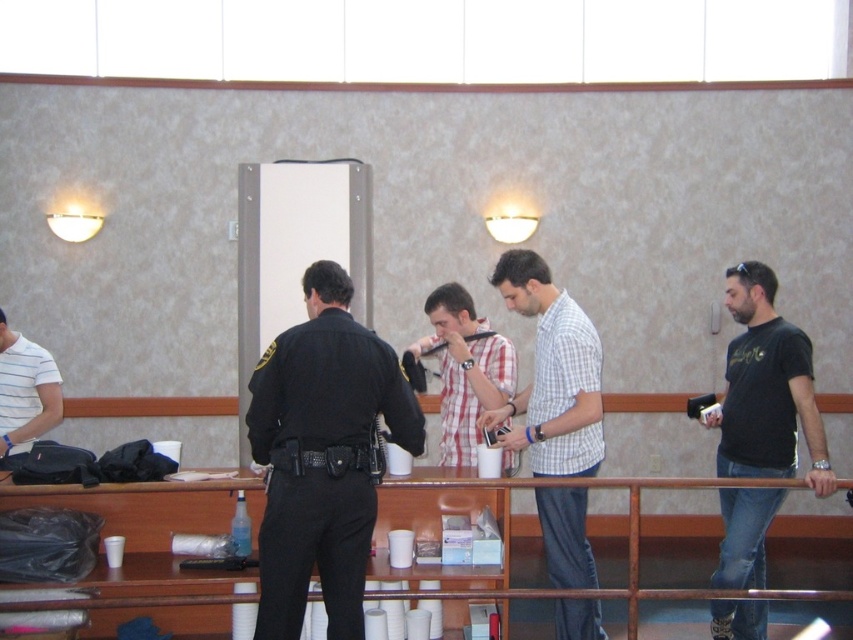
Measure the distance between point (267, 580) and camera.

Point (267, 580) and camera are 9.52 feet apart from each other.

Who is more distant from viewer, (x=357, y=324) or (x=160, y=486)?

Positioned behind is point (x=160, y=486).

Locate an element on the screen. The width and height of the screenshot is (853, 640). black uniform at center is located at coordinates click(x=323, y=456).

Which is behind, point (747, 364) or point (7, 422)?

Point (7, 422)

Is point (724, 422) closer to viewer compared to point (28, 349)?

Yes.

Identify the location of black matte t-shirt at right. This screenshot has width=853, height=640. (766, 388).

Who is taller, plaid cotton shirt at center or white striped shirt at left?

Standing taller between the two is plaid cotton shirt at center.

Which is more to the left, plaid cotton shirt at center or white striped shirt at left?

From the viewer's perspective, white striped shirt at left appears more on the left side.

What do you see at coordinates (463, 369) in the screenshot? I see `plaid cotton shirt at center` at bounding box center [463, 369].

Find the location of a particular element. plaid cotton shirt at center is located at coordinates click(x=463, y=369).